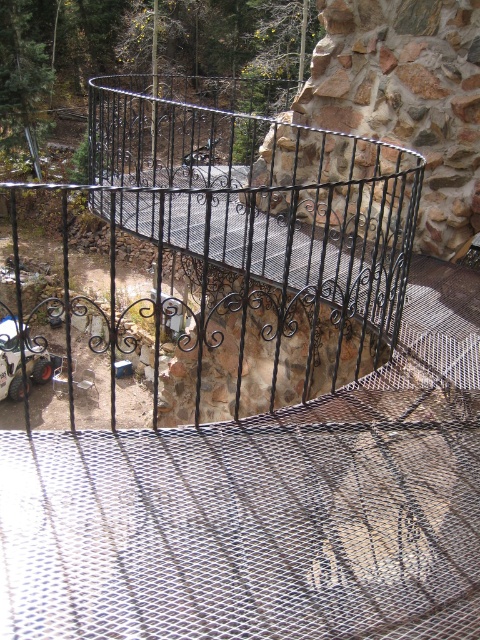
Consider the image. You are standing at the base of the spiral staircase in the image. You notice a point marked at coordinates point (260,244). Based on the scene, can you determine what structure this point is located on?

The point (260,244) is located on the black wrought iron cage at center, which forms part of the spiral staircase structure.